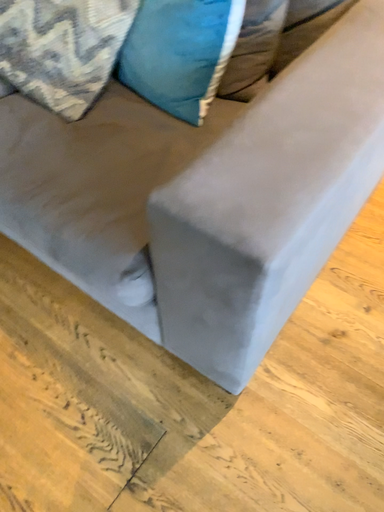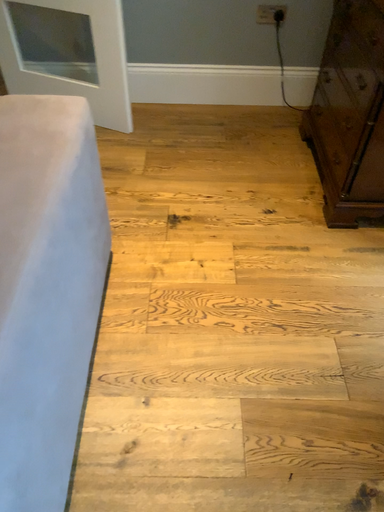
Question: How did the camera likely rotate when shooting the video?

Choices:
 (A) rotated upward
 (B) rotated downward

Answer: (A)